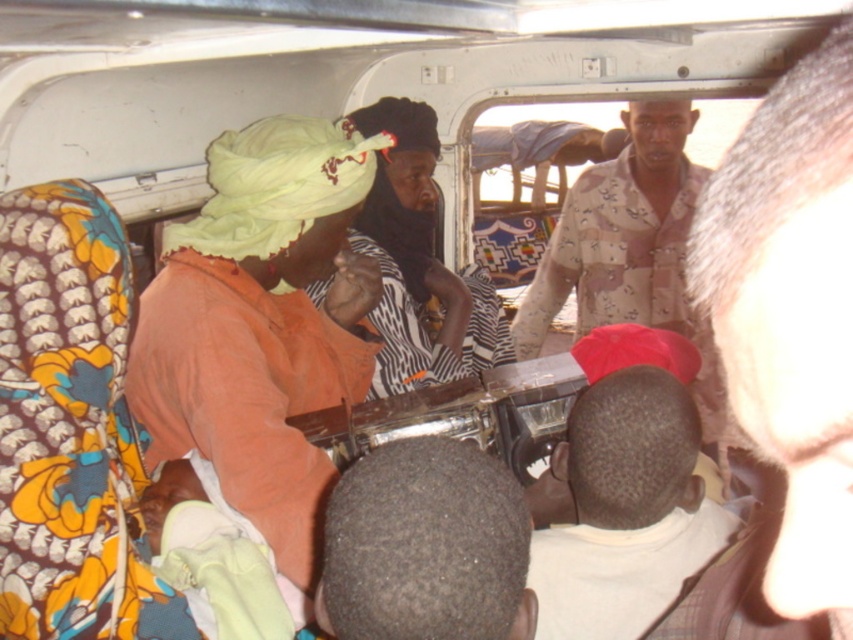
From the picture: You are a photographer trying to capture a candid shot of the two subjects in the vehicle. The white matte shirt at center and the dark hair at center are both in your frame. Based on their positions, which subject is to the right of the other?

The white matte shirt at center is positioned on the right side of dark hair at center, so the white matte shirt at center is to the right of the dark hair at center.

You are a photographer standing in the vehicle and want to take a closeup photo of the dark brown leather hat at upper right. The camera you are using has a minimum focusing distance of 10 inches. Will you be able to take the photo without moving closer?

The dark brown leather hat at upper right is 9.85 inches from the camera, which is within the minimum focusing distance of 10 inches. Therefore, you can take the closeup photo without moving closer.